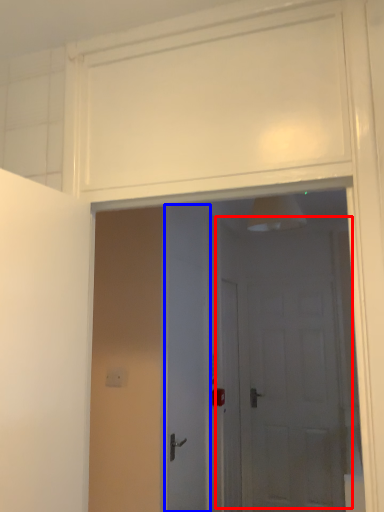
Question: Which object appears closest to the camera in this image, door (highlighted by a red box) or door (highlighted by a blue box)?

Choices:
 (A) door
 (B) door

Answer: (B)